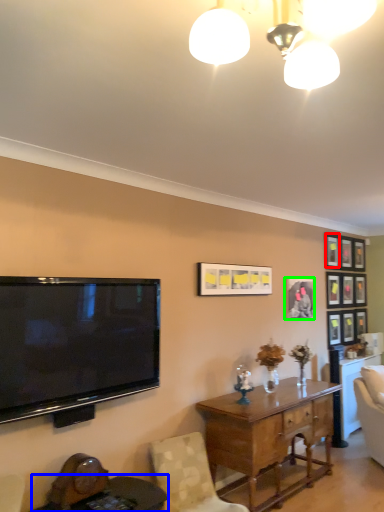
Question: Considering the real-world distances, which object is closest to picture frame (highlighted by a red box)? round table (highlighted by a blue box) or picture frame (highlighted by a green box).

Choices:
 (A) round table
 (B) picture frame

Answer: (B)